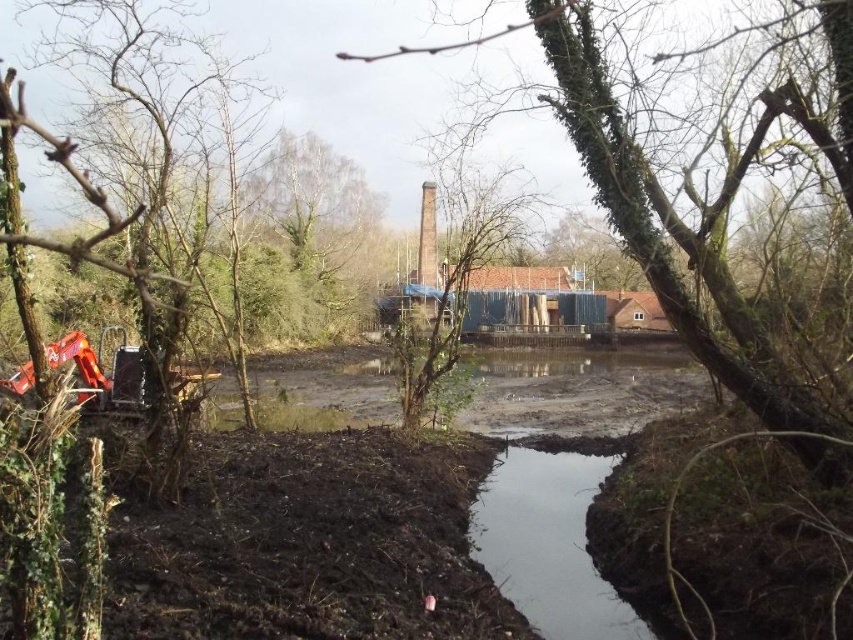
Question: Does clear water at center come behind green mossy tree at center?

Choices:
 (A) yes
 (B) no

Answer: (B)

Question: Among these objects, which one is nearest to the camera?

Choices:
 (A) green mossy tree at center
 (B) clear water at center

Answer: (B)

Question: Can you confirm if clear water at center is wider than green mossy tree at center?

Choices:
 (A) yes
 (B) no

Answer: (A)

Question: Does clear water at center have a smaller size compared to green mossy tree at center?

Choices:
 (A) no
 (B) yes

Answer: (A)

Question: Which point appears closest to the camera in this image?

Choices:
 (A) (595, 477)
 (B) (543, 42)

Answer: (B)